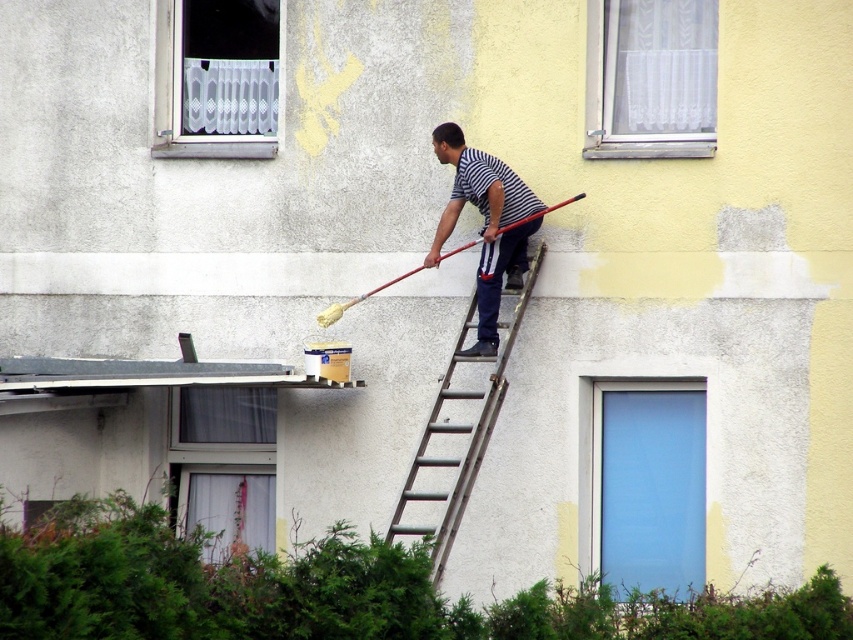
Question: Which object is positioned closest to the white lace curtain at upper left?

Choices:
 (A) striped fabric shirt at center
 (B) white sheer curtain at upper center
 (C) metallic silver ladder at center

Answer: (A)

Question: Which object is positioned farthest from the striped fabric shirt at center?

Choices:
 (A) white sheer curtain at upper center
 (B) matte glass window at lower center
 (C) metallic silver ladder at center

Answer: (B)

Question: Is the position of transparent glass door at center less distant than that of matte glass window at lower center?

Choices:
 (A) yes
 (B) no

Answer: (A)

Question: Where is matte glass window at lower center located in relation to metallic silver ladder at center in the image?

Choices:
 (A) right
 (B) left

Answer: (B)

Question: Is white sheer curtain at upper center positioned behind white lace curtain at upper left?

Choices:
 (A) yes
 (B) no

Answer: (B)

Question: Among these points, which one is farthest from the camera?

Choices:
 (A) [x=254, y=128]
 (B) [x=210, y=506]
 (C) [x=671, y=436]

Answer: (B)